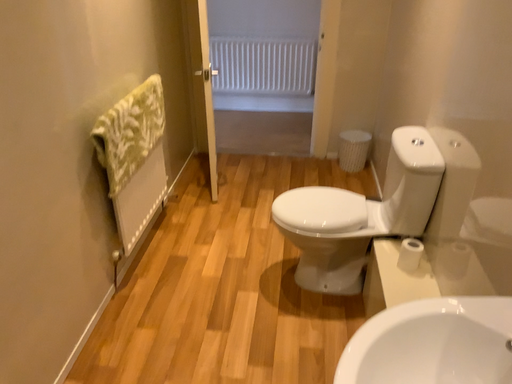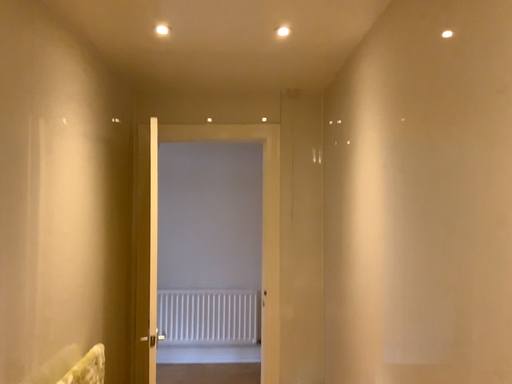
Question: Which way did the camera rotate in the video?

Choices:
 (A) rotated downward
 (B) rotated upward

Answer: (B)